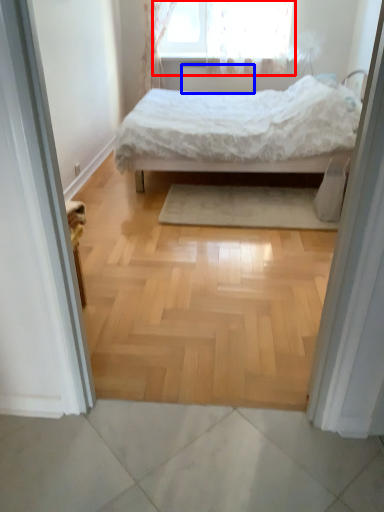
Question: Which point is closer to the camera, window (highlighted by a red box) or radiator (highlighted by a blue box)?

Choices:
 (A) window
 (B) radiator

Answer: (A)